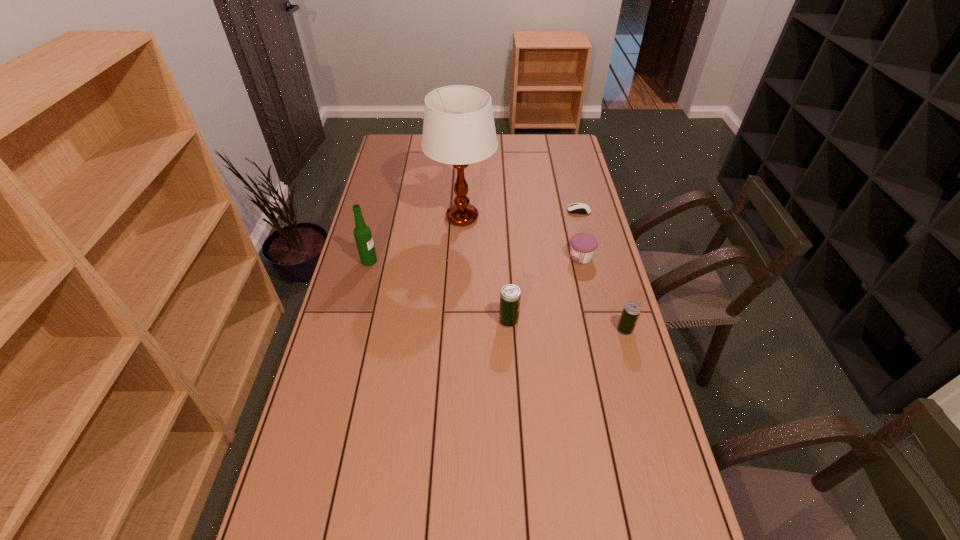
Locate an element on the screen. The height and width of the screenshot is (540, 960). the fourth shortest object is located at coordinates (510, 296).

Locate an element on the screen. the left beer can is located at coordinates (510, 296).

Locate an element on the screen. the right beer can is located at coordinates (x=632, y=309).

Where is `the shorter beer can`? the shorter beer can is located at coordinates (632, 309).

This screenshot has width=960, height=540. Identify the location of the tallest object. (458, 128).

This screenshot has width=960, height=540. Find the location of `the fifth tallest object`. the fifth tallest object is located at coordinates (582, 245).

Locate an element on the screen. Image resolution: width=960 pixels, height=540 pixels. the second tallest object is located at coordinates (362, 233).

This screenshot has height=540, width=960. I want to click on the leftmost object, so click(362, 233).

The height and width of the screenshot is (540, 960). I want to click on mouse, so click(x=576, y=208).

I want to click on vacant space located 0.390m on the front of the taller beer can, so click(516, 454).